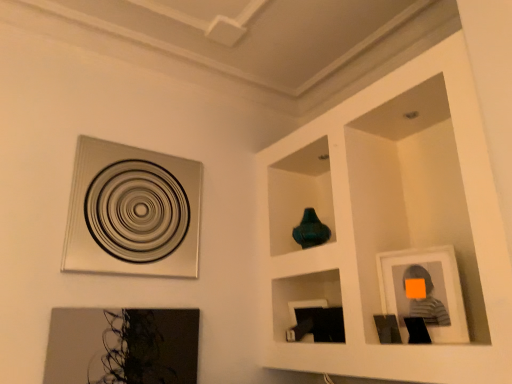
Measure the distance between point (71, 326) and camera.

Point (71, 326) and camera are 5.46 feet apart from each other.

Describe the element at coordinates (122, 346) in the screenshot. I see `matte black picture frame at lower left, the 2th picture frame in the left-to-right sequence` at that location.

How much space does matte gray picture frame at right, which is the 3th picture frame in left-to-right order, occupy horizontally?

matte gray picture frame at right, which is the 3th picture frame in left-to-right order, is 1.18 inches in width.

Locate an element on the screen. The image size is (512, 384). metallic silver picture frame at upper left, the first picture frame in the left-to-right sequence is located at coordinates (132, 212).

This screenshot has height=384, width=512. What do you see at coordinates (132, 212) in the screenshot?
I see `metallic silver picture frame at upper left, the first picture frame in the left-to-right sequence` at bounding box center [132, 212].

Identify the location of matte black picture frame at lower left, the 2th picture frame in the left-to-right sequence. (122, 346).

Based on their sizes in the image, would you say metallic silver picture frame at upper left, acting as the third picture frame starting from the right, is bigger or smaller than matte gray picture frame at right, which is the 3th picture frame in left-to-right order?

In the image, metallic silver picture frame at upper left, acting as the third picture frame starting from the right, appears to be larger than matte gray picture frame at right, which is the 3th picture frame in left-to-right order.

Locate an element on the screen. This screenshot has height=384, width=512. picture frame that is the 2nd object to the right of the metallic silver picture frame at upper left, acting as the third picture frame starting from the right, starting at the anchor is located at coordinates (426, 291).

Is metallic silver picture frame at upper left, acting as the third picture frame starting from the right, further to camera compared to matte gray picture frame at right, the first picture frame when ordered from right to left?

Yes, it is behind matte gray picture frame at right, the first picture frame when ordered from right to left.

Which is closer to the camera, (115, 165) or (450, 314)?

Clearly, point (115, 165) is more distant from the camera than point (450, 314).

From a real-world perspective, which is physically below, metallic silver picture frame at upper left, the first picture frame in the left-to-right sequence, or matte black picture frame at lower left, the 2th picture frame in the left-to-right sequence?

In real-world perspective, matte black picture frame at lower left, the 2th picture frame in the left-to-right sequence, is lower.

Is metallic silver picture frame at upper left, acting as the third picture frame starting from the right, at the right side of matte black picture frame at lower left, the 2th picture frame in the left-to-right sequence?

Incorrect, metallic silver picture frame at upper left, acting as the third picture frame starting from the right, is not on the right side of matte black picture frame at lower left, the 2th picture frame in the left-to-right sequence.

Is metallic silver picture frame at upper left, acting as the third picture frame starting from the right, in contact with matte black picture frame at lower left, the 2th picture frame in the left-to-right sequence?

No, metallic silver picture frame at upper left, acting as the third picture frame starting from the right, is not next to matte black picture frame at lower left, the 2th picture frame in the left-to-right sequence.

Is metallic silver picture frame at upper left, the first picture frame in the left-to-right sequence, outside of matte black picture frame at lower left, the 2th picture frame in the left-to-right sequence?

metallic silver picture frame at upper left, the first picture frame in the left-to-right sequence, lies outside matte black picture frame at lower left, the 2th picture frame in the left-to-right sequence,'s area.

Locate an element on the screen. picture frame that is the 1st object to the left of the matte gray picture frame at right, which is the 3th picture frame in left-to-right order, starting at the anchor is located at coordinates (122, 346).

From a real-world perspective, does matte black picture frame at lower left, the 2th picture frame in the left-to-right sequence, stand above matte gray picture frame at right, the first picture frame when ordered from right to left?

No, from a real-world perspective, matte black picture frame at lower left, the 2th picture frame in the left-to-right sequence, is not above matte gray picture frame at right, the first picture frame when ordered from right to left.

From the image's perspective, is matte black picture frame at lower left, the 2th picture frame in the right-to-left sequence, above or below matte gray picture frame at right, the first picture frame when ordered from right to left?

Based on their image positions, matte black picture frame at lower left, the 2th picture frame in the right-to-left sequence, is located beneath matte gray picture frame at right, the first picture frame when ordered from right to left.

Is point (181, 362) farther from camera compared to point (81, 175)?

Yes, it is.

Between matte black picture frame at lower left, the 2th picture frame in the right-to-left sequence, and metallic silver picture frame at upper left, the first picture frame in the left-to-right sequence, which one appears on the right side from the viewer's perspective?

Positioned to the right is matte black picture frame at lower left, the 2th picture frame in the right-to-left sequence.

Locate an element on the screen. picture frame that is the 2nd object located above the matte black picture frame at lower left, the 2th picture frame in the right-to-left sequence (from the image's perspective) is located at coordinates (132, 212).

Considering the relative sizes of matte black picture frame at lower left, the 2th picture frame in the left-to-right sequence, and metallic silver picture frame at upper left, the first picture frame in the left-to-right sequence, in the image provided, is matte black picture frame at lower left, the 2th picture frame in the left-to-right sequence, taller than metallic silver picture frame at upper left, the first picture frame in the left-to-right sequence,?

No, matte black picture frame at lower left, the 2th picture frame in the left-to-right sequence, is not taller than metallic silver picture frame at upper left, the first picture frame in the left-to-right sequence.

Could you measure the distance between matte gray picture frame at right, the first picture frame when ordered from right to left, and matte black picture frame at lower left, the 2th picture frame in the left-to-right sequence?

matte gray picture frame at right, the first picture frame when ordered from right to left, is 1.05 meters away from matte black picture frame at lower left, the 2th picture frame in the left-to-right sequence.

From the image's perspective, which is below, matte gray picture frame at right, the first picture frame when ordered from right to left, or matte black picture frame at lower left, the 2th picture frame in the right-to-left sequence?

From the image's view, matte black picture frame at lower left, the 2th picture frame in the right-to-left sequence, is below.

Is matte gray picture frame at right, the first picture frame when ordered from right to left, directly adjacent to matte black picture frame at lower left, the 2th picture frame in the left-to-right sequence?

matte gray picture frame at right, the first picture frame when ordered from right to left, is not next to matte black picture frame at lower left, the 2th picture frame in the left-to-right sequence, and they're not touching.

Would you say matte black picture frame at lower left, the 2th picture frame in the left-to-right sequence, is part of matte gray picture frame at right, which is the 3th picture frame in left-to-right order,'s contents?

No, matte black picture frame at lower left, the 2th picture frame in the left-to-right sequence, is located outside of matte gray picture frame at right, which is the 3th picture frame in left-to-right order.

How many degrees apart are the facing directions of matte gray picture frame at right, which is the 3th picture frame in left-to-right order, and metallic silver picture frame at upper left, the first picture frame in the left-to-right sequence?

The angle between the facing direction of matte gray picture frame at right, which is the 3th picture frame in left-to-right order, and the facing direction of metallic silver picture frame at upper left, the first picture frame in the left-to-right sequence, is 67.9 degrees.

Between matte gray picture frame at right, the first picture frame when ordered from right to left, and metallic silver picture frame at upper left, acting as the third picture frame starting from the right, which one is positioned behind?

metallic silver picture frame at upper left, acting as the third picture frame starting from the right, is more distant.

Which picture frame is the 2nd one when counting from the front of the metallic silver picture frame at upper left, acting as the third picture frame starting from the right? Please provide its 2D coordinates.

[(426, 291)]

Considering the relative positions of matte gray picture frame at right, the first picture frame when ordered from right to left, and metallic silver picture frame at upper left, acting as the third picture frame starting from the right, in the image provided, is matte gray picture frame at right, the first picture frame when ordered from right to left, to the left or to the right of metallic silver picture frame at upper left, acting as the third picture frame starting from the right,?

Clearly, matte gray picture frame at right, the first picture frame when ordered from right to left, is on the right of metallic silver picture frame at upper left, acting as the third picture frame starting from the right, in the image.

Which picture frame is the 2nd one when counting from the back of the matte gray picture frame at right, the first picture frame when ordered from right to left? Please provide its 2D coordinates.

[(132, 212)]

Find the location of a particular element. picture frame on the left of matte black picture frame at lower left, the 2th picture frame in the left-to-right sequence is located at coordinates pos(132,212).

Looking at the image, which one is located further to metallic silver picture frame at upper left, acting as the third picture frame starting from the right, matte black picture frame at lower left, the 2th picture frame in the left-to-right sequence, or matte gray picture frame at right, which is the 3th picture frame in left-to-right order?

matte gray picture frame at right, which is the 3th picture frame in left-to-right order, is further to metallic silver picture frame at upper left, acting as the third picture frame starting from the right.

Looking at the image, which one is located closer to matte gray picture frame at right, which is the 3th picture frame in left-to-right order, metallic silver picture frame at upper left, acting as the third picture frame starting from the right, or matte black picture frame at lower left, the 2th picture frame in the right-to-left sequence?

matte black picture frame at lower left, the 2th picture frame in the right-to-left sequence.

Looking at the image, which one is located further to matte black picture frame at lower left, the 2th picture frame in the right-to-left sequence, matte gray picture frame at right, the first picture frame when ordered from right to left, or metallic silver picture frame at upper left, the first picture frame in the left-to-right sequence?

matte gray picture frame at right, the first picture frame when ordered from right to left, is positioned further to the anchor matte black picture frame at lower left, the 2th picture frame in the right-to-left sequence.

Estimate the real-world distances between objects in this image. Which object is closer to matte black picture frame at lower left, the 2th picture frame in the right-to-left sequence, metallic silver picture frame at upper left, the first picture frame in the left-to-right sequence, or matte gray picture frame at right, which is the 3th picture frame in left-to-right order?

metallic silver picture frame at upper left, the first picture frame in the left-to-right sequence, lies closer to matte black picture frame at lower left, the 2th picture frame in the right-to-left sequence, than the other object.

Based on their spatial positions, is matte gray picture frame at right, which is the 3th picture frame in left-to-right order, or matte black picture frame at lower left, the 2th picture frame in the left-to-right sequence, further from metallic silver picture frame at upper left, the first picture frame in the left-to-right sequence?

Among the two, matte gray picture frame at right, which is the 3th picture frame in left-to-right order, is located further to metallic silver picture frame at upper left, the first picture frame in the left-to-right sequence.

Based on their spatial positions, is matte black picture frame at lower left, the 2th picture frame in the left-to-right sequence, or metallic silver picture frame at upper left, acting as the third picture frame starting from the right, closer to matte gray picture frame at right, the first picture frame when ordered from right to left?

Based on the image, matte black picture frame at lower left, the 2th picture frame in the left-to-right sequence, appears to be nearer to matte gray picture frame at right, the first picture frame when ordered from right to left.

The image size is (512, 384). I want to click on picture frame located between metallic silver picture frame at upper left, the first picture frame in the left-to-right sequence, and matte gray picture frame at right, the first picture frame when ordered from right to left, in the left-right direction, so click(122, 346).